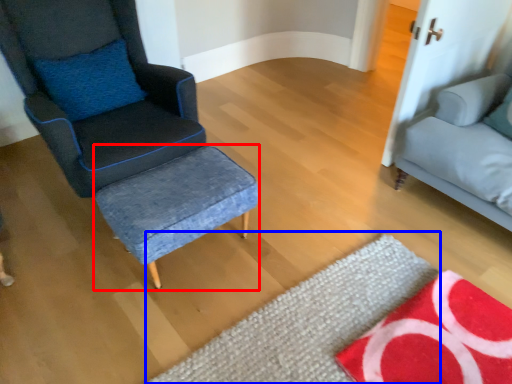
Question: Which object is further to the camera taking this photo, stool (highlighted by a red box) or mat (highlighted by a blue box)?

Choices:
 (A) stool
 (B) mat

Answer: (A)